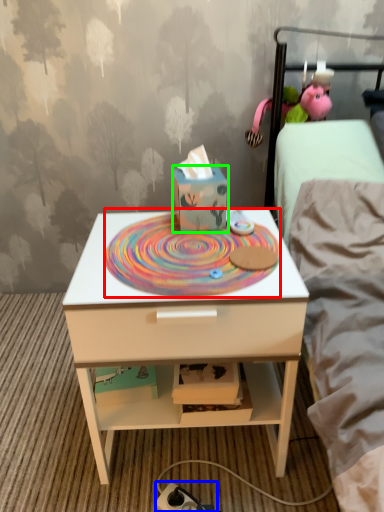
Question: Which object is the farthest from design (highlighted by a red box)? Choose among these: charger (highlighted by a blue box) or cardboard box (highlighted by a green box).

Choices:
 (A) charger
 (B) cardboard box

Answer: (A)